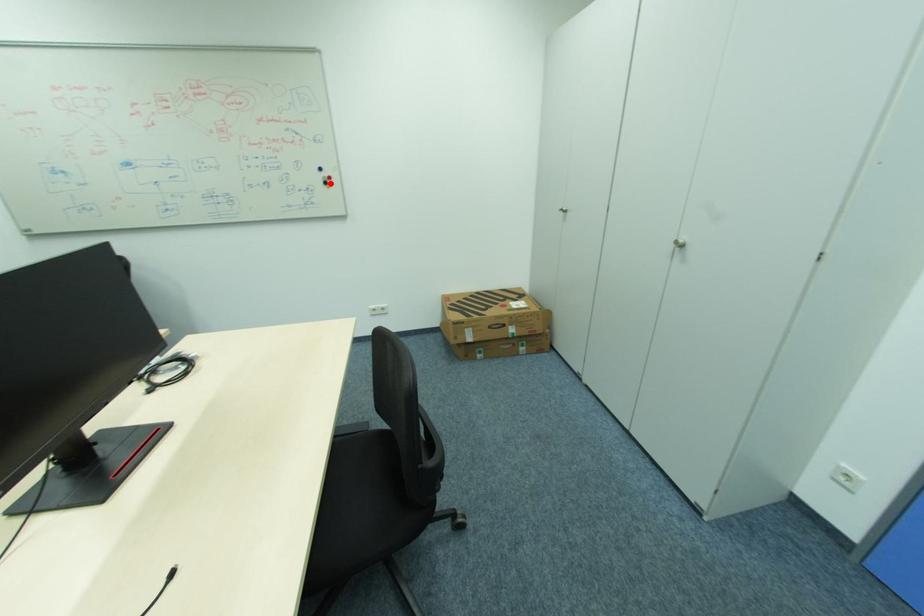
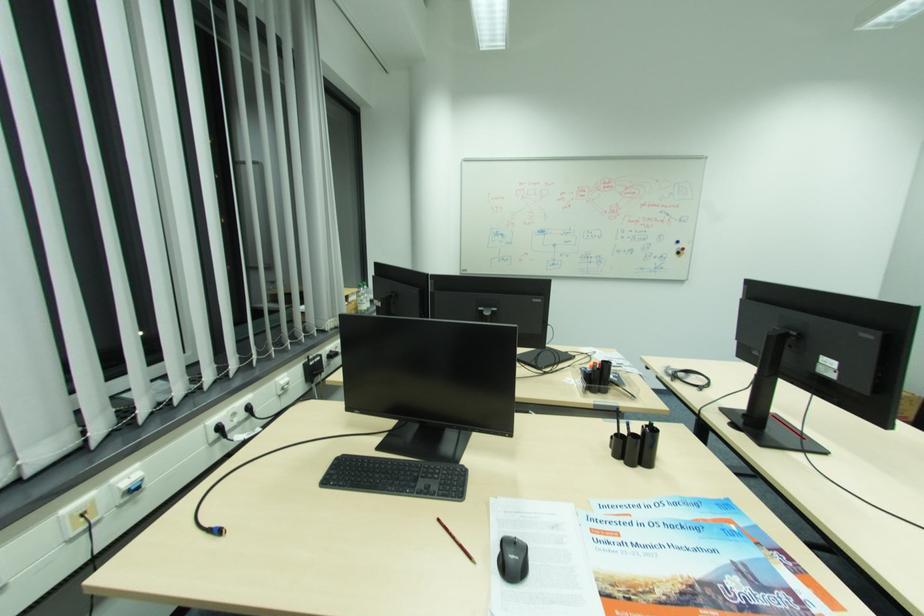
Question: I am providing you with two images of the same scene from different viewpoints. A red point is marked on the first image. Can you still see the location of the red point in image 2?

Choices:
 (A) Yes
 (B) No

Answer: (A)